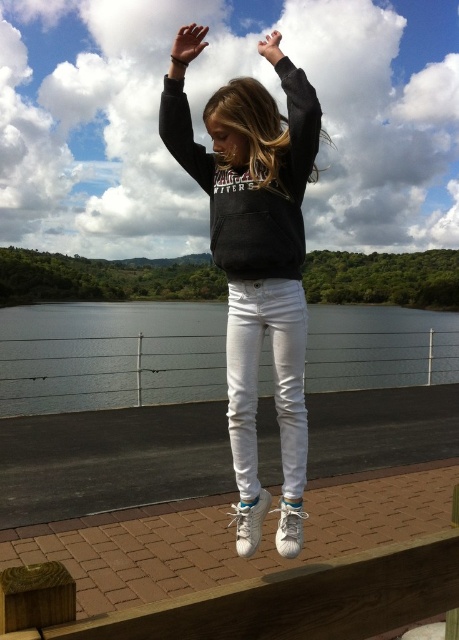
Question: Is matte black sweatshirt at upper center in front of white matte hand at upper center?

Choices:
 (A) yes
 (B) no

Answer: (A)

Question: Which point is farther from the camera taking this photo?

Choices:
 (A) (105, 321)
 (B) (162, 138)

Answer: (A)

Question: Which of these objects is positioned closest to the black matte sweatshirt at center?

Choices:
 (A) black matte sweatshirt at upper center
 (B) brown leather hand at upper center

Answer: (A)

Question: Does matte black hoodie at center have a smaller size compared to glossy water at center?

Choices:
 (A) no
 (B) yes

Answer: (B)

Question: Which object is the farthest from the matte black sweatshirt at upper center?

Choices:
 (A) black matte sweatshirt at center
 (B) brown leather hand at upper center

Answer: (B)

Question: Can you confirm if glossy water at center is smaller than black matte sweatshirt at center?

Choices:
 (A) yes
 (B) no

Answer: (B)